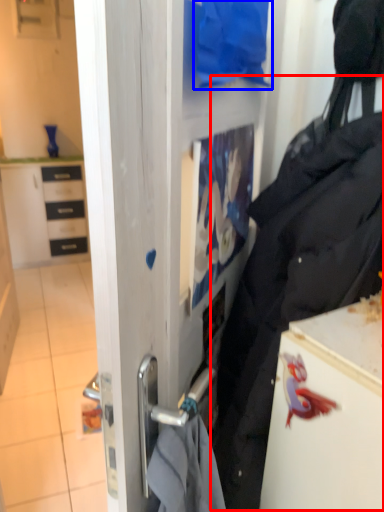
Question: Which object is further to the camera taking this photo, tote bag (highlighted by a red box) or clothing (highlighted by a blue box)?

Choices:
 (A) tote bag
 (B) clothing

Answer: (B)